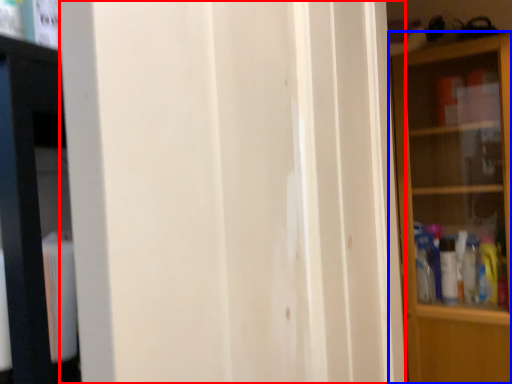
Question: Which of the following is the closest to the observer, screen door (highlighted by a red box) or shelf (highlighted by a blue box)?

Choices:
 (A) screen door
 (B) shelf

Answer: (A)